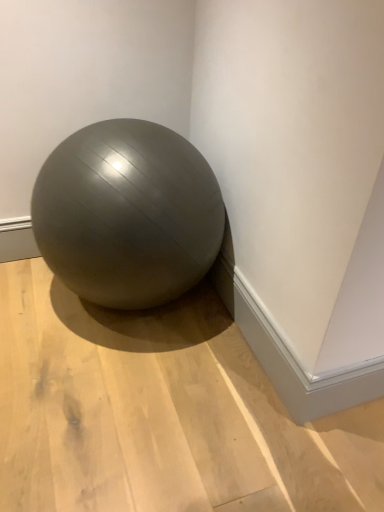
Question: Is matte gray ball at center not near satin gray ball at center?

Choices:
 (A) yes
 (B) no

Answer: (B)

Question: Is matte gray ball at center aimed at satin gray ball at center?

Choices:
 (A) yes
 (B) no

Answer: (B)

Question: Is matte gray ball at center smaller than satin gray ball at center?

Choices:
 (A) no
 (B) yes

Answer: (B)

Question: From the image's perspective, is matte gray ball at center beneath satin gray ball at center?

Choices:
 (A) yes
 (B) no

Answer: (A)

Question: Can you confirm if matte gray ball at center is positioned to the right of satin gray ball at center?

Choices:
 (A) yes
 (B) no

Answer: (A)

Question: Considering the relative sizes of matte gray ball at center and satin gray ball at center in the image provided, is matte gray ball at center thinner than satin gray ball at center?

Choices:
 (A) yes
 (B) no

Answer: (B)

Question: Considering the relative sizes of satin gray ball at center and matte gray ball at center in the image provided, is satin gray ball at center smaller than matte gray ball at center?

Choices:
 (A) yes
 (B) no

Answer: (B)

Question: Is satin gray ball at center taller than matte gray ball at center?

Choices:
 (A) no
 (B) yes

Answer: (B)

Question: Is satin gray ball at center positioned before matte gray ball at center?

Choices:
 (A) no
 (B) yes

Answer: (A)

Question: Is satin gray ball at center bigger than matte gray ball at center?

Choices:
 (A) yes
 (B) no

Answer: (A)

Question: From the image's perspective, is satin gray ball at center below matte gray ball at center?

Choices:
 (A) no
 (B) yes

Answer: (A)

Question: Is satin gray ball at center at the left side of matte gray ball at center?

Choices:
 (A) yes
 (B) no

Answer: (A)

Question: From their relative heights in the image, would you say satin gray ball at center is taller or shorter than matte gray ball at center?

Choices:
 (A) tall
 (B) short

Answer: (A)